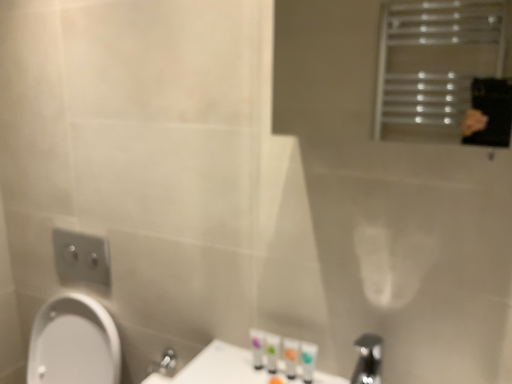
Question: Is the depth of translucent plastic bottles at lower center, which is the first toiletry in left-to-right order, less than that of white glossy tube at lower center, which ranks as the fourth toiletry in left-to-right order?

Choices:
 (A) no
 (B) yes

Answer: (A)

Question: Does translucent plastic bottles at lower center, acting as the 4th toiletry starting from the right, have a smaller size compared to white glossy tube at lower center, the first toiletry viewed from the right?

Choices:
 (A) no
 (B) yes

Answer: (A)

Question: From a real-world perspective, is translucent plastic bottles at lower center, acting as the 4th toiletry starting from the right, under white glossy tube at lower center, which ranks as the fourth toiletry in left-to-right order?

Choices:
 (A) no
 (B) yes

Answer: (B)

Question: Is translucent plastic bottles at lower center, acting as the 4th toiletry starting from the right, thinner than white glossy tube at lower center, which ranks as the fourth toiletry in left-to-right order?

Choices:
 (A) no
 (B) yes

Answer: (A)

Question: Is translucent plastic bottles at lower center, which is the first toiletry in left-to-right order, bigger than white glossy tube at lower center, which ranks as the fourth toiletry in left-to-right order?

Choices:
 (A) no
 (B) yes

Answer: (B)

Question: Is white glossy tube at lower center, the first toiletry viewed from the right, completely or partially inside translucent plastic bottles at lower center, which is the first toiletry in left-to-right order?

Choices:
 (A) no
 (B) yes

Answer: (A)

Question: Is silver metallic tap at lower right facing towards white glossy tube at lower center, the first toiletry viewed from the right?

Choices:
 (A) no
 (B) yes

Answer: (A)

Question: From a real-world perspective, is silver metallic tap at lower right on white glossy tube at lower center, which ranks as the fourth toiletry in left-to-right order?

Choices:
 (A) yes
 (B) no

Answer: (A)

Question: Could white glossy tube at lower center, which ranks as the fourth toiletry in left-to-right order, be considered to be inside silver metallic tap at lower right?

Choices:
 (A) no
 (B) yes

Answer: (A)

Question: From the image's perspective, does silver metallic tap at lower right appear higher than white glossy tube at lower center, which ranks as the fourth toiletry in left-to-right order?

Choices:
 (A) no
 (B) yes

Answer: (A)

Question: Does silver metallic tap at lower right lie behind white glossy tube at lower center, the first toiletry viewed from the right?

Choices:
 (A) no
 (B) yes

Answer: (A)

Question: Is silver metallic tap at lower right not inside white glossy tube at lower center, the first toiletry viewed from the right?

Choices:
 (A) no
 (B) yes

Answer: (B)

Question: Can you see white glossy tube at lower center, which ranks as the fourth toiletry in left-to-right order, touching silver metallic tap at lower right?

Choices:
 (A) no
 (B) yes

Answer: (A)